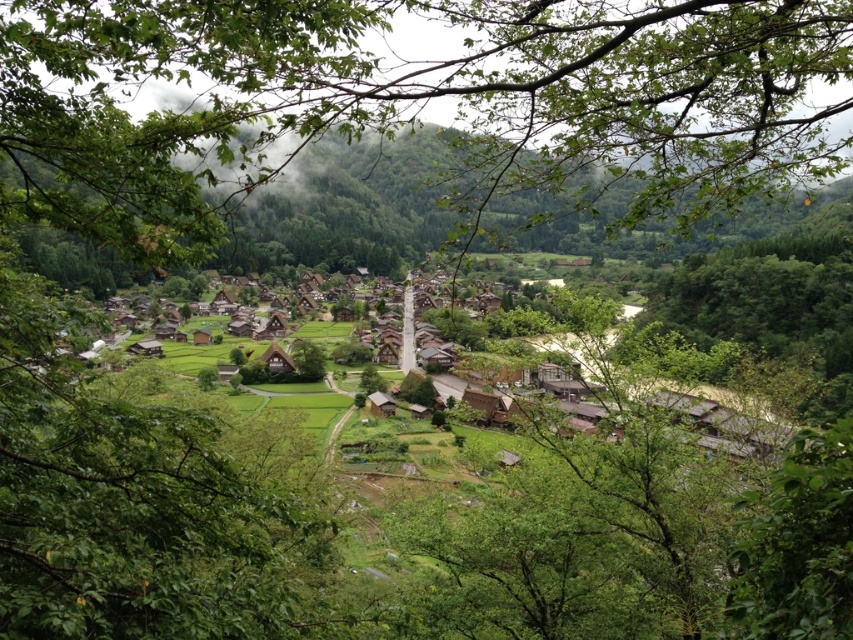
Question: Among these objects, which one is nearest to the camera?

Choices:
 (A) wooden thatched hut at center
 (B) wooden hut at center

Answer: (B)

Question: Among these points, which one is farthest from the camera?

Choices:
 (A) (448, 84)
 (B) (291, 364)
 (C) (386, 403)

Answer: (B)

Question: Which object appears farthest from the camera in this image?

Choices:
 (A) wooden hut at center
 (B) wooden thatched hut at center

Answer: (B)

Question: Can you confirm if green leafy branches at center is positioned below wooden thatched hut at center?

Choices:
 (A) yes
 (B) no

Answer: (B)

Question: Is the position of green leafy branches at center more distant than that of wooden hut at center?

Choices:
 (A) yes
 (B) no

Answer: (B)

Question: Can you confirm if green leafy branches at center is positioned below wooden hut at center?

Choices:
 (A) yes
 (B) no

Answer: (B)